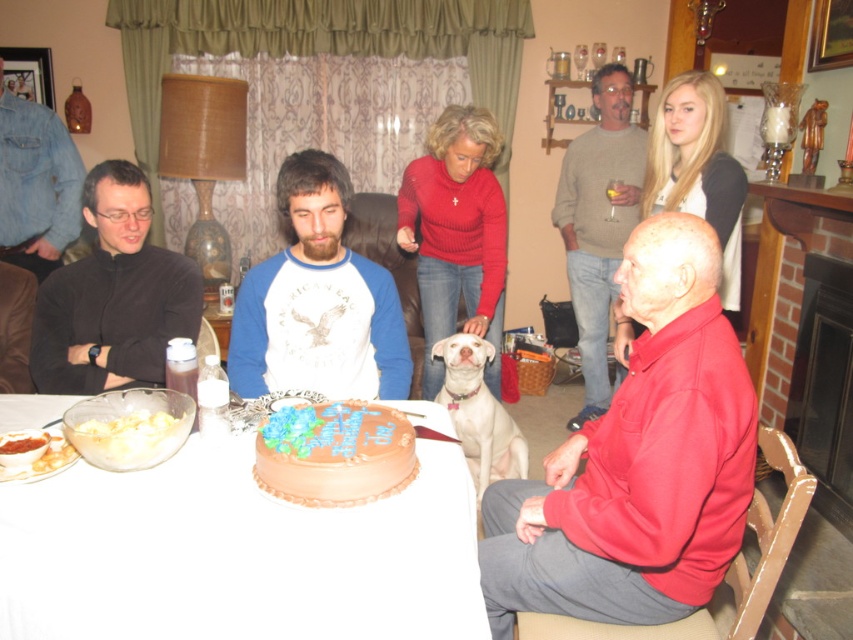
This screenshot has height=640, width=853. What are the coordinates of `chocolate glaze cake at center` in the screenshot? It's located at (334, 452).

Is chocolate glaze cake at center above denim jacket at left?

Incorrect, chocolate glaze cake at center is not positioned above denim jacket at left.

What do you see at coordinates (334, 452) in the screenshot?
I see `chocolate glaze cake at center` at bounding box center [334, 452].

Where is `chocolate glaze cake at center`? chocolate glaze cake at center is located at coordinates (334, 452).

How far apart are black matte shirt at left and white fur dog at center?

black matte shirt at left and white fur dog at center are 3.43 feet apart from each other.

Who is taller, black matte shirt at left or white fur dog at center?

Standing taller between the two is black matte shirt at left.

Measure the distance between black matte shirt at left and camera.

black matte shirt at left is 2.01 meters away from camera.

This screenshot has width=853, height=640. I want to click on black matte shirt at left, so click(x=113, y=296).

How distant is blue cotton shirt at center from matte gray sweater at center?

blue cotton shirt at center is 5.37 feet away from matte gray sweater at center.

Is point (376, 307) more distant than point (590, 260)?

No, (376, 307) is in front of (590, 260).

Is point (294, 216) farther from viewer compared to point (606, 337)?

No, it is not.

This screenshot has width=853, height=640. In order to click on blue cotton shirt at center in this screenshot , I will do `click(317, 301)`.